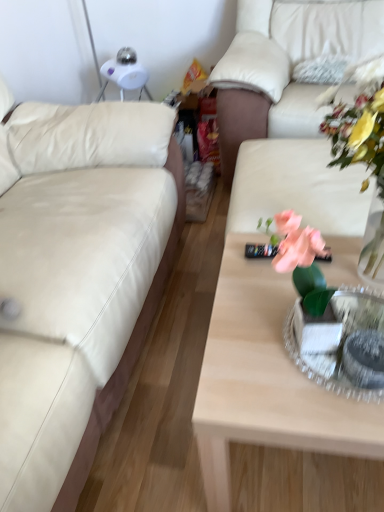
Where is `vacant area on top of metallic silver tray at center (from a real-world perspective)`? The width and height of the screenshot is (384, 512). vacant area on top of metallic silver tray at center (from a real-world perspective) is located at coordinates (350, 325).